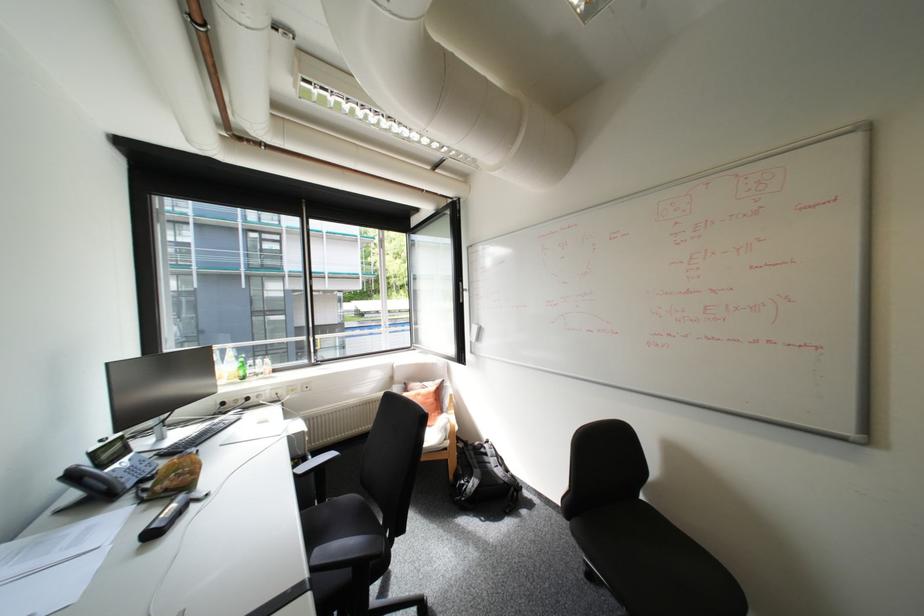
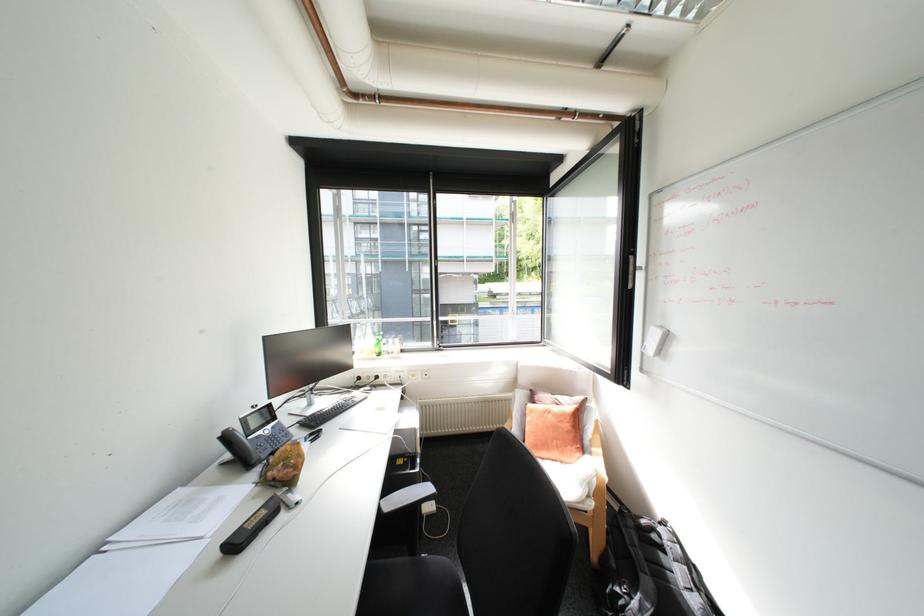
In the second image, find the point that corresponds to [480,341] in the first image.

(652, 353)